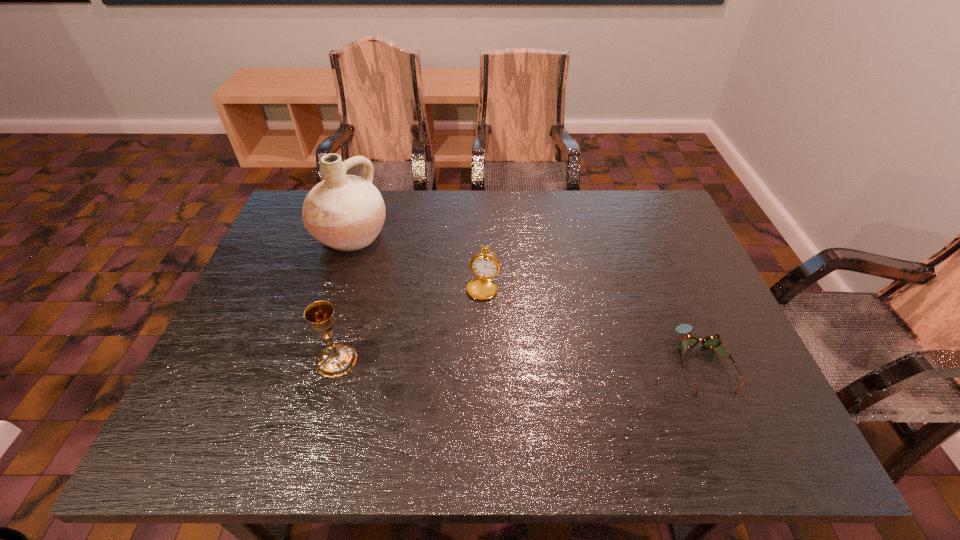
At what (x,y) coordinates should I click in order to perform the action: click on free space on the desktop that is between the chalice and the spectacles and is positioned on the face of the second object from right to left. Please return your answer as a coordinate pair (x, y). The image size is (960, 540). Looking at the image, I should click on (474, 361).

The image size is (960, 540). I want to click on free spot on the desktop that is between the chalice and the shortest object and is positioned to pour from the handle of the tallest object, so click(x=516, y=361).